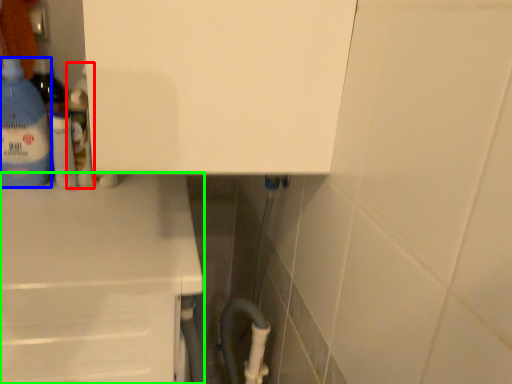
Question: Based on their relative distances, which object is nearer to bottle (highlighted by a red box)? Choose from bottle (highlighted by a blue box) and counter (highlighted by a green box).

Choices:
 (A) bottle
 (B) counter

Answer: (A)